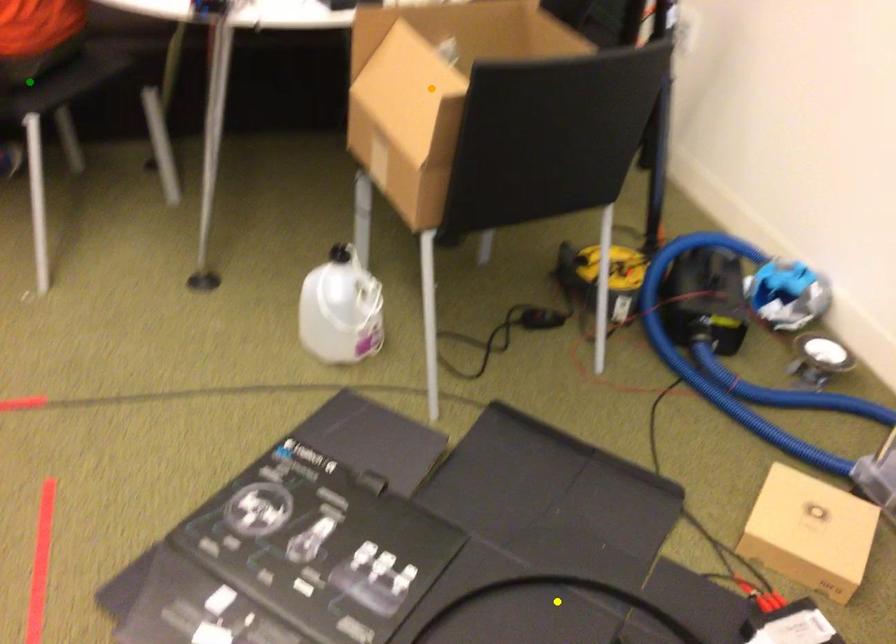
Order these from farthest to nearest:
green point | orange point | yellow point

1. green point
2. orange point
3. yellow point